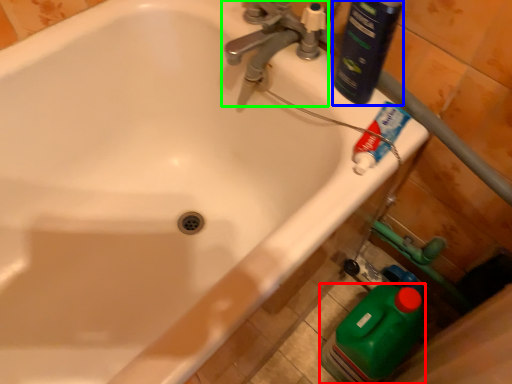
Question: Based on their relative distances, which object is nearer to cleaning product (highlighted by a red box)? Choose from cleaning product (highlighted by a blue box) and tap (highlighted by a green box).

Choices:
 (A) cleaning product
 (B) tap

Answer: (A)